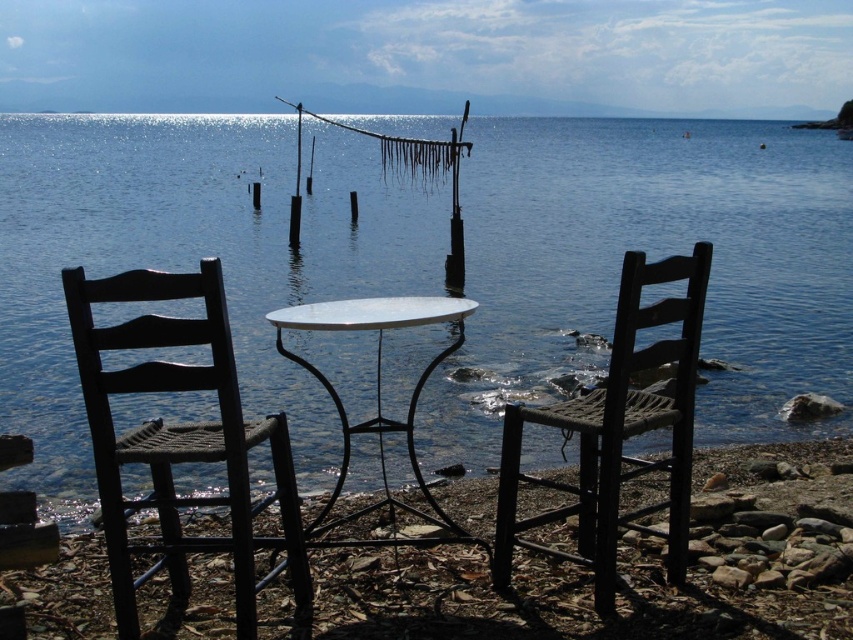
You are a photographer setting up equipment on the rocky shore. You have two tables in front of you, the rustic wood table at center and the white marble table at center. Which table should you place your camera on if you want it to be closer to the water?

You should place your camera on the white marble table at center because the rustic wood table at center is to the right of it, meaning the white marble table is closer to the water.

You are a photographer setting up equipment on the rocky shore. You need to place a tripod between the rustic wood table at center and the woven wood chair at center. Based on their positions, where should you place the tripod to ensure it is between them?

The rustic wood table at center is below the woven wood chair at center, so placing the tripod between them would require positioning it above the table but below the chair. However, since both objects are on the same plane on the shore, the tripod should be placed in the space between their physical locations, likely closer to the table since it is lower.